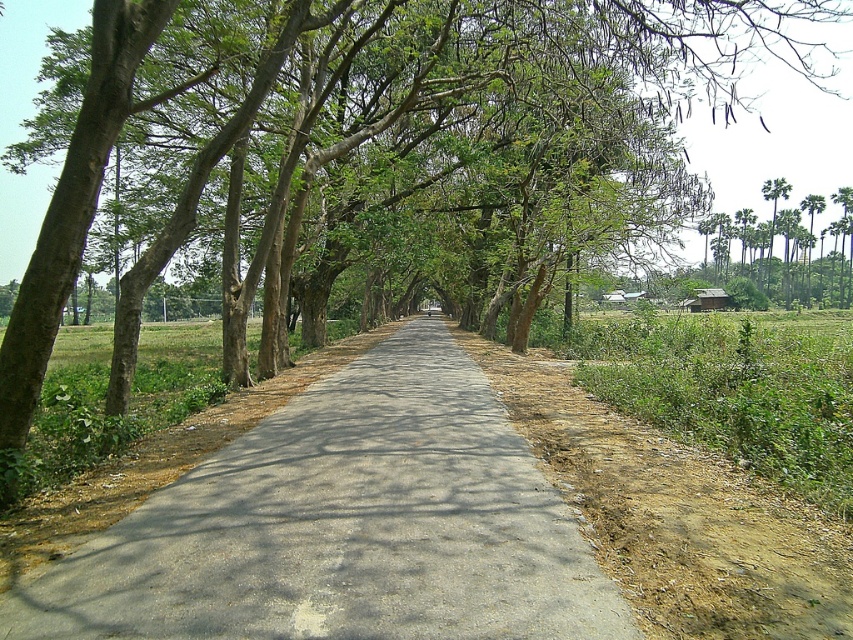
You are a photographer standing at the edge of the gray concrete road at center, aiming to capture the green leafy palm trees at right in your shot. Based on their relative heights, which object would appear taller in the photograph?

The green leafy palm trees at right would appear taller in the photograph because the gray concrete road at center is not as tall as them according to the description.

You are standing at the starting point of the gray concrete road at center. If you walk straight ahead, where will you end up? Please provide the coordinates as per the image coordinate system.

The gray concrete road at center ends at the horizon, so walking straight ahead will lead you to the coordinates point at approximately where the road converges at the horizon. However, the exact coordinates aren not provided in the description. But according to the given coordinate of the road at center is at point (344, 525), so the end point would be near the horizon point which is typically around 1.0 in the y coordinate if following a standard image coordinate system.